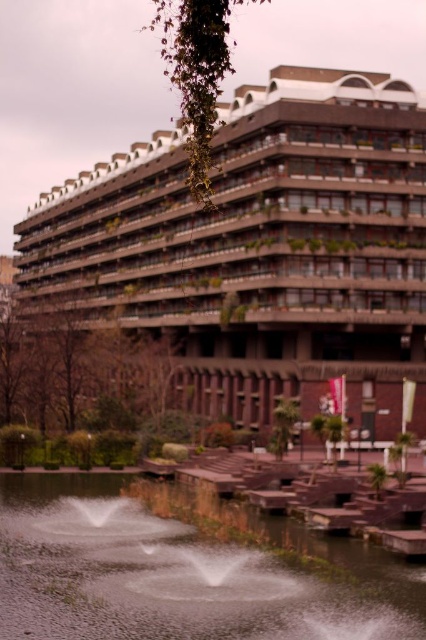
You are a drone operator trying to capture aerial footage of the brown concrete building at center and the clear water at center. Based on their widths, which one would require a wider camera frame to fully capture in the shot?

The brown concrete building at center might be wider than clear water at center, so it would require a wider camera frame to fully capture in the shot.

You are standing at the center of the image and want to locate the brown concrete building at center. According to the coordinates provided, in which direction should you move to find it?

The brown concrete building at center is located at coordinates point (258, 250). Since you are already at the center, you are already facing the brown concrete building at center.

You are standing at a safe distance from the brown concrete building at center. If the recommended safe distance for taking a photo of this building is 50 meters, can you safely take a photo from your current position?

The brown concrete building at center is 58.74 meters away from viewer, which exceeds the recommended safe distance of 50 meters. Therefore, you can safely take a photo from your current position as you are farther away than the required distance.